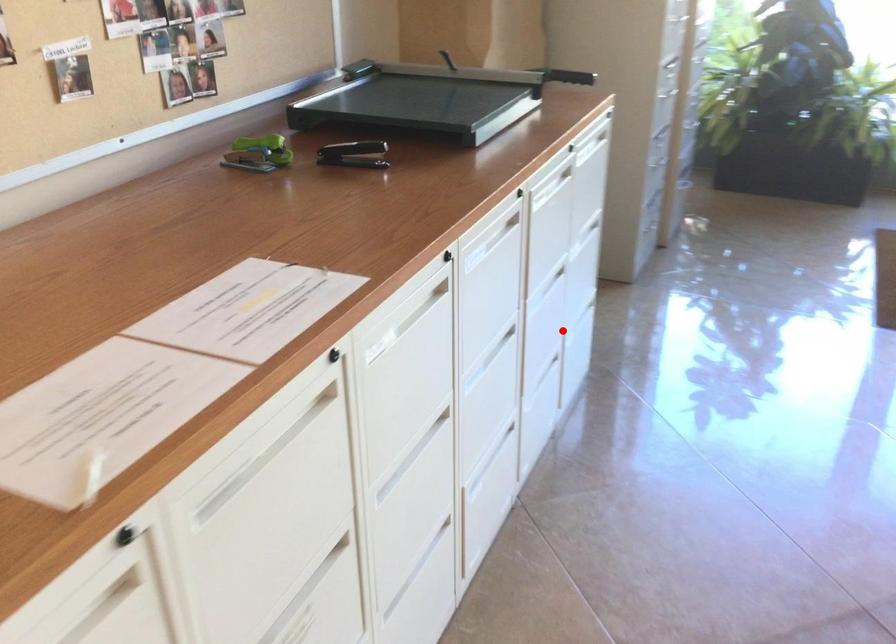
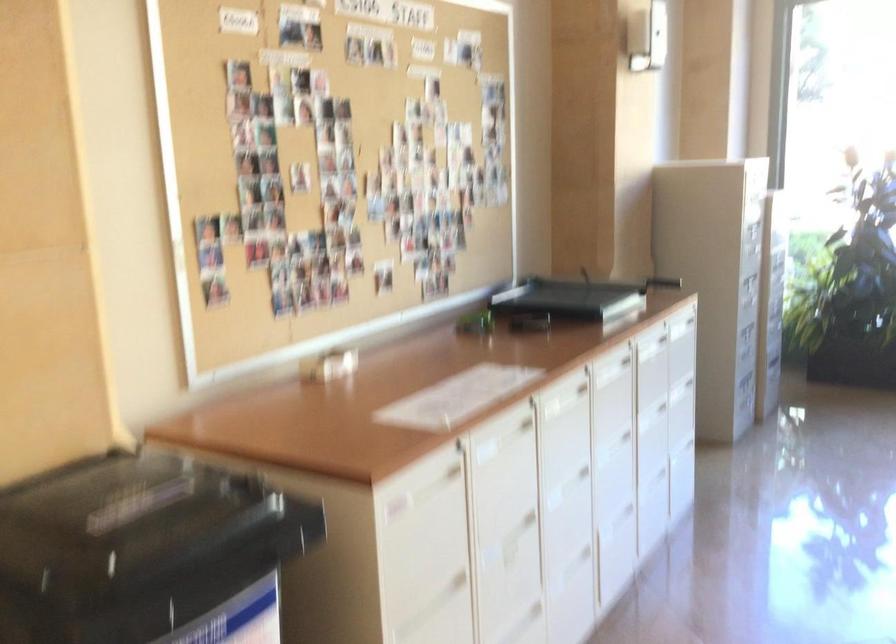
In the second image, find the point that corresponds to the highlighted location in the first image.

(676, 444)